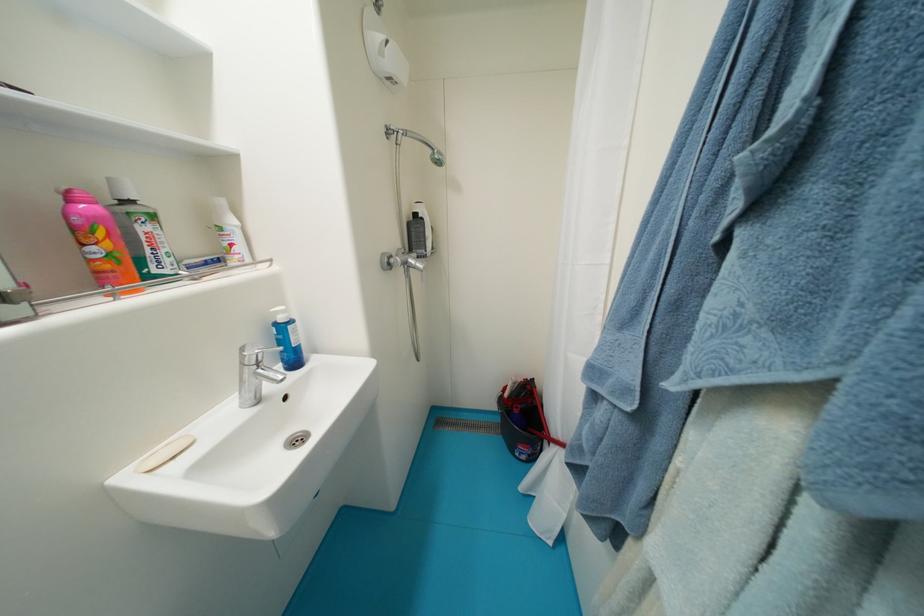
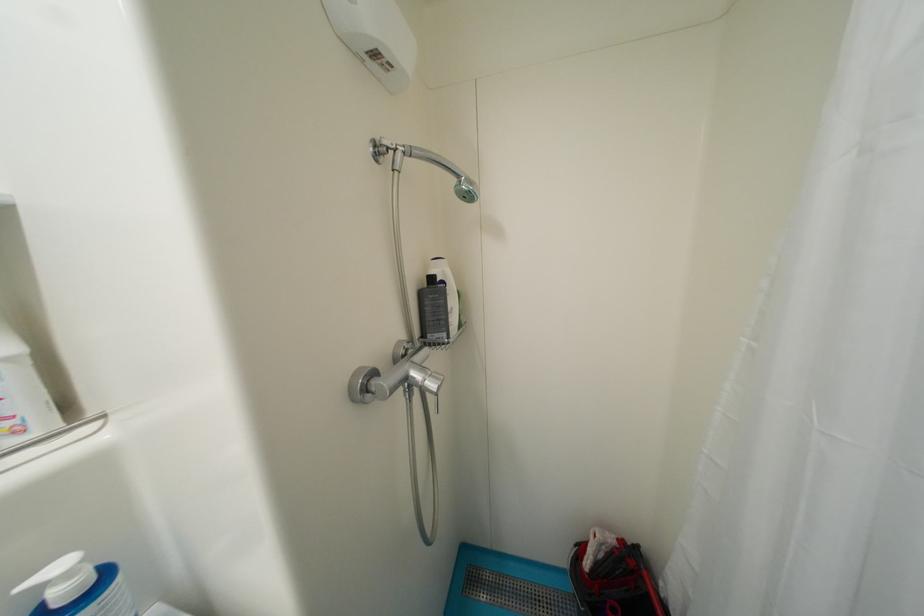
Find the pixel in the second image that matches (x=289, y=314) in the first image.

(75, 576)